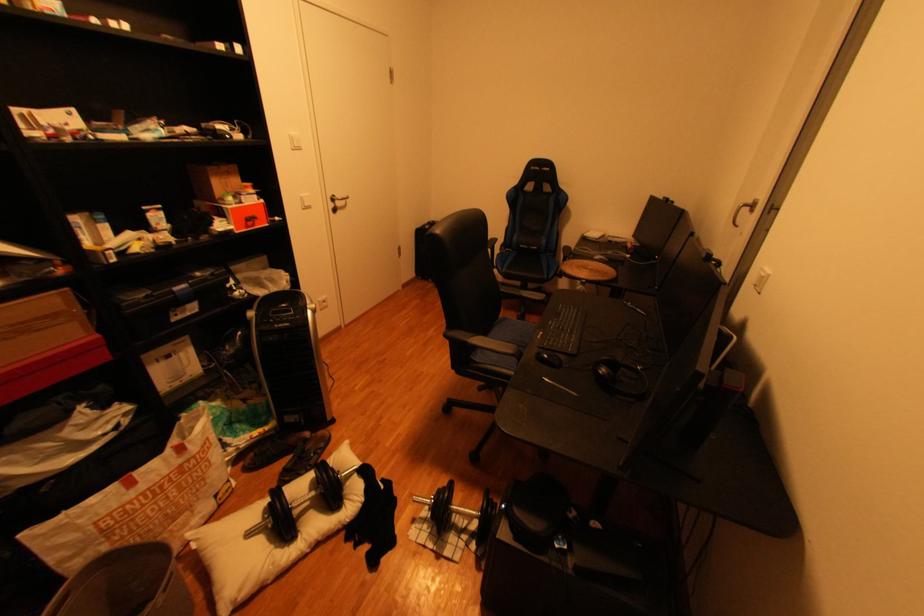
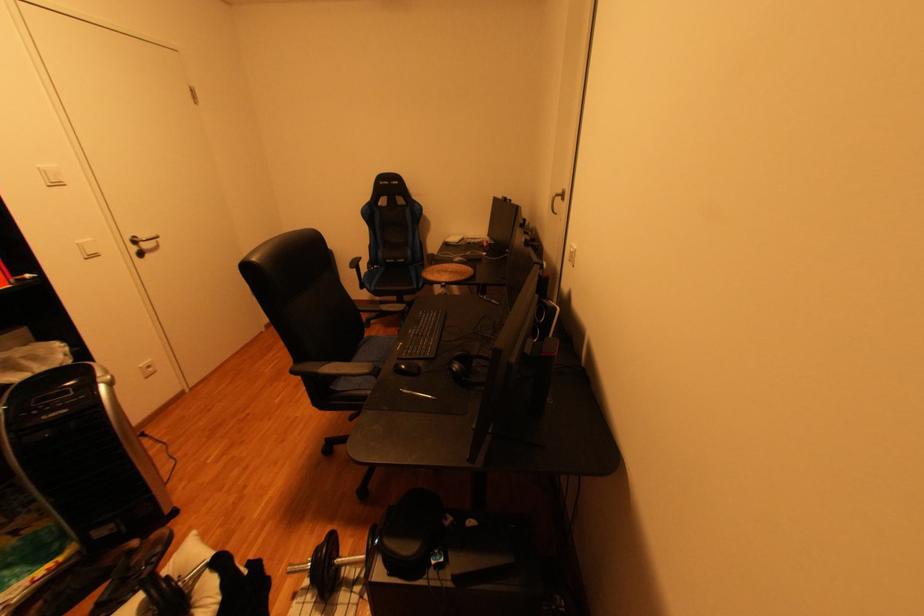
Question: In a continuous first-person perspective shot, in which direction is the camera moving?

Choices:
 (A) Left
 (B) Right
 (C) Forward
 (D) Backward

Answer: (B)